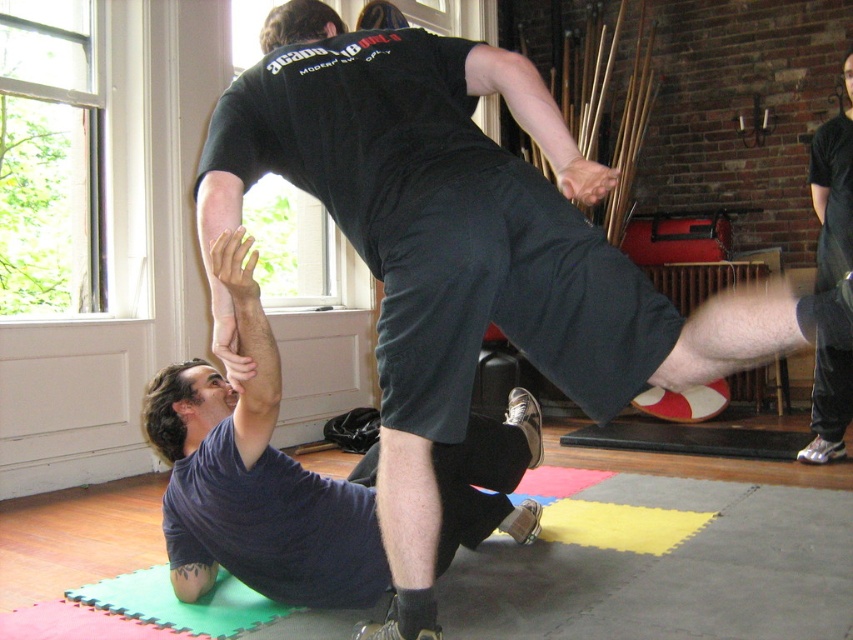
You are a martial artist practicing on the green foam yoga mat at lower left. You need to grab the dark blue fabric squat at lower left to complete a move. Can you reach it without moving your feet?

The dark blue fabric squat at lower left is 14.17 inches away from the green foam yoga mat at lower left. Since this distance is within typical arm reach for most adults, you can likely reach it without moving your feet.

You are trying to place a new equipment on the floor in the scene. The dark blue fabric squat at lower left and the green foam yoga mat at lower left are already there. Can you fit the equipment between them if it requires 1.2 meters of space?

The dark blue fabric squat at lower left might be wider than green foam yoga mat at lower left, so the distance between them is uncertain. Without knowing the exact width of the dark blue fabric squat at lower left and green foam yoga mat at lower left, it is impossible to determine if there is enough space for the equipment requiring 1.2 meters.

From the picture: You are a martial arts instructor observing the practice session. You notice a point marked at coordinates (254, 477) on the image. Based on the scene description, what object is located at that point?

The point at coordinates (254, 477) marks the location of the dark blue fabric squat at lower left.